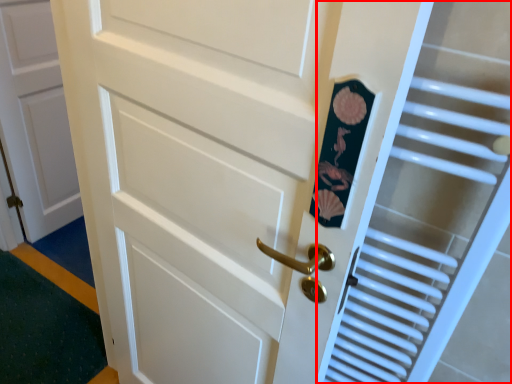
Question: From the image's perspective, where is elevator (annotated by the red box) located in relation to door in the image?

Choices:
 (A) below
 (B) above

Answer: (A)